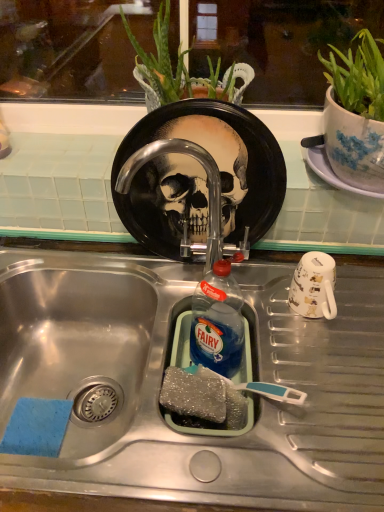
You are a GUI agent. You are given a task and a screenshot of the screen. Output one action in this format:
    pyautogui.click(x=<x>, y=<y>)
    Task: Click on the free region on the left part of white glossy mug at right
    The height and width of the screenshot is (512, 384).
    Given the screenshot: What is the action you would take?
    pyautogui.click(x=229, y=325)